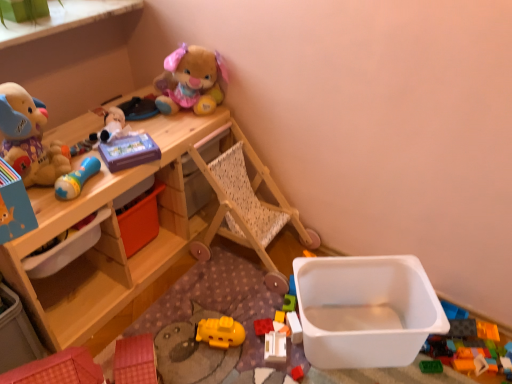
This screenshot has height=384, width=512. I want to click on vacant space in front of rubberized red block at center, the second toy from the bottom, so click(x=263, y=364).